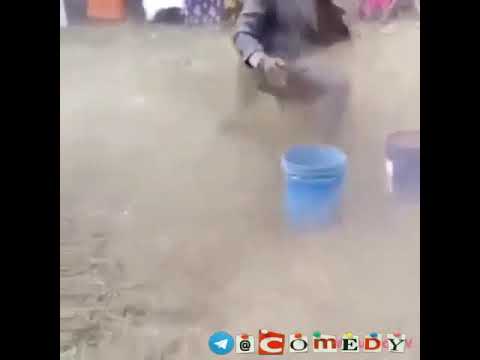
You are a GUI agent. You are given a task and a screenshot of the screen. Output one action in this format:
    pyautogui.click(x=<x>, y=<y>)
    Task: Click on the dark blue bucket
    
    Given the screenshot: What is the action you would take?
    [408, 177]